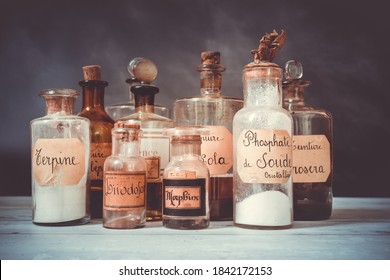
The height and width of the screenshot is (280, 390). I want to click on wall, so click(191, 47).